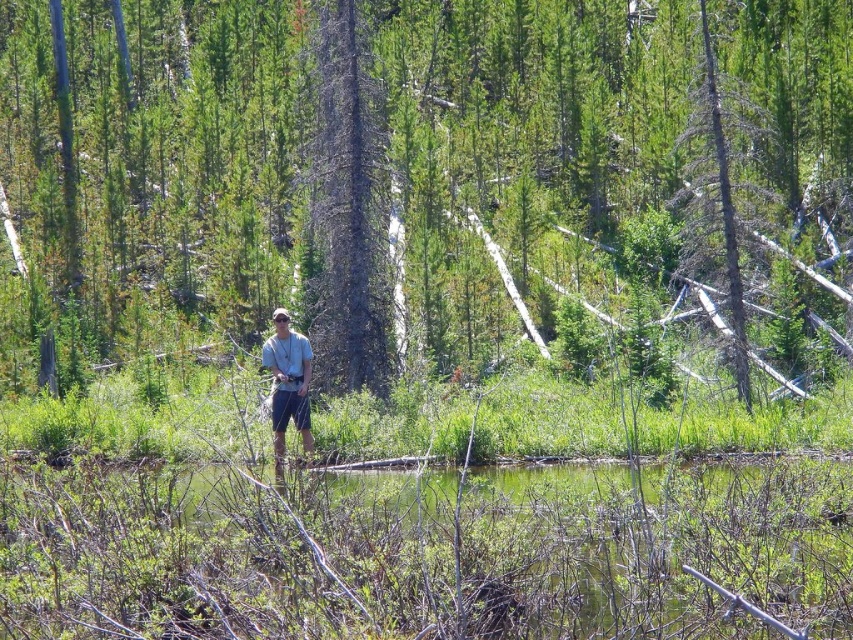
Which of these two, green textured tree at center or dead wood tree at upper right, stands shorter?

With less height is dead wood tree at upper right.

The width and height of the screenshot is (853, 640). Describe the element at coordinates (421, 172) in the screenshot. I see `green textured tree at center` at that location.

Is point (128, 216) in front of point (724, 168)?

That is False.

Find the location of a particular element. green textured tree at center is located at coordinates (421, 172).

Which is below, dark gray bark tree at center or dead wood tree at upper right?

Positioned lower is dark gray bark tree at center.

Is point (328, 42) closer to viewer compared to point (734, 300)?

No.

Who is more distant from viewer, (318,76) or (721,152)?

The point (318,76) is more distant.

Where is `dark gray bark tree at center`? The height and width of the screenshot is (640, 853). dark gray bark tree at center is located at coordinates tap(346, 212).

Between green textured tree at center and green liquid water at center, which one appears on the right side from the viewer's perspective?

green liquid water at center is more to the right.

Does green textured tree at center have a larger size compared to green liquid water at center?

Indeed, green textured tree at center has a larger size compared to green liquid water at center.

Between point (161, 81) and point (825, 627), which one is positioned in front?

Positioned in front is point (825, 627).

Find the location of `green textured tree at center`. green textured tree at center is located at coordinates (421, 172).